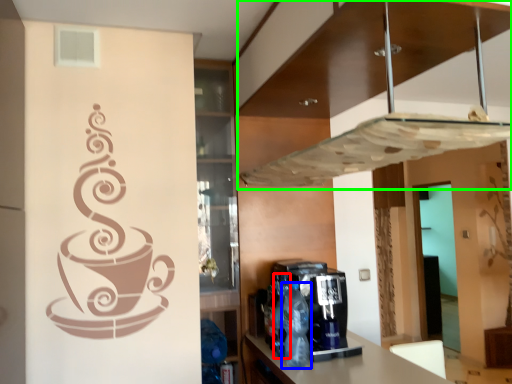
Question: Estimate the real-world distances between objects in this image. Which object is farther from bottle (highlighted by a red box), bottle (highlighted by a blue box) or exhaust hood (highlighted by a green box)?

Choices:
 (A) bottle
 (B) exhaust hood

Answer: (B)